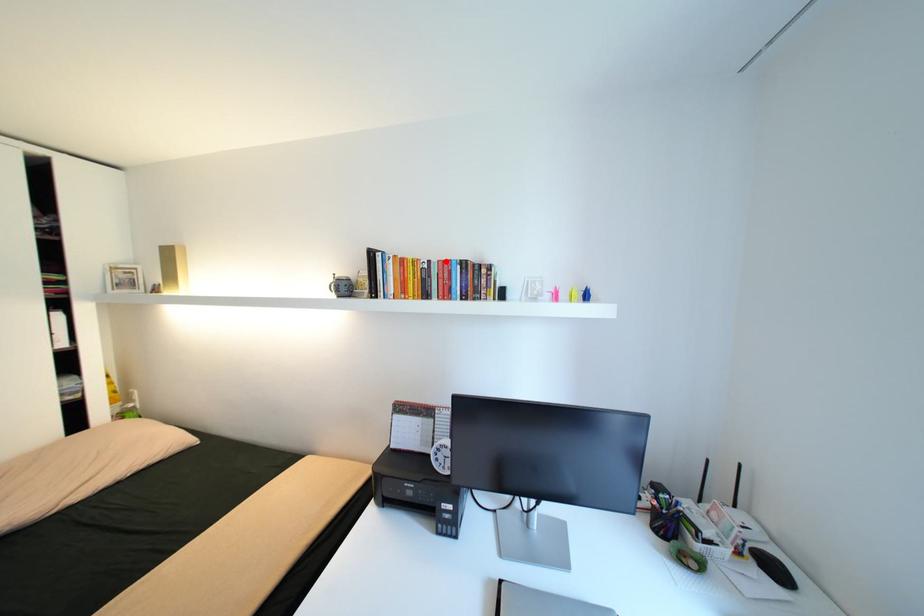
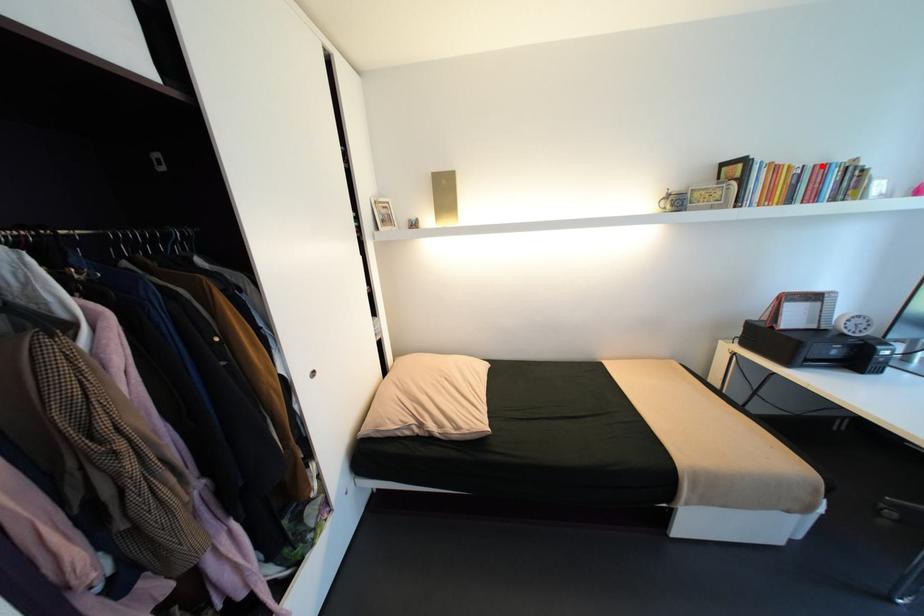
I am providing you with two images of the same scene from different viewpoints. A red point is marked on the first image and another point is marked on the second image. Is the marked point in image1 the same physical position as the marked point in image2?

Yes